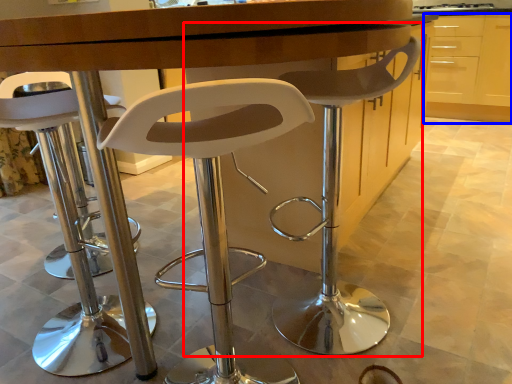
Question: Which object appears farthest to the camera in this image, chair (highlighted by a red box) or cabinetry (highlighted by a blue box)?

Choices:
 (A) chair
 (B) cabinetry

Answer: (B)